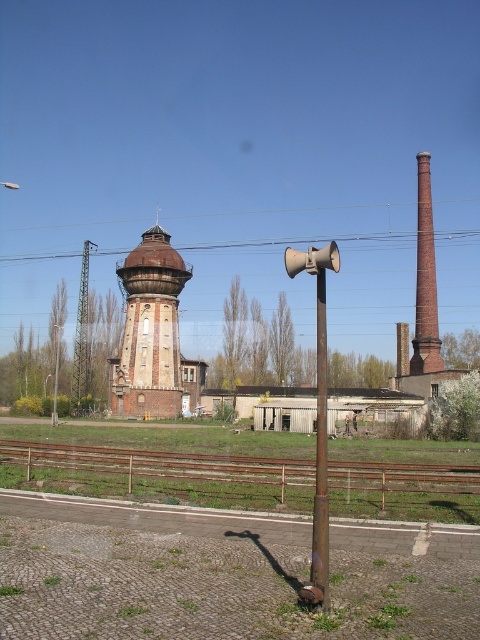
Question: Is brick textured water tower at center positioned at the back of metallic pole at center?

Choices:
 (A) no
 (B) yes

Answer: (B)

Question: Does red brick chimney at right have a smaller size compared to metallic pole at center?

Choices:
 (A) no
 (B) yes

Answer: (A)

Question: Which point is farther from the camera taking this photo?

Choices:
 (A) tap(430, 257)
 (B) tap(408, 356)

Answer: (B)

Question: Which point appears farthest from the camera in this image?

Choices:
 (A) (321, 380)
 (B) (121, 403)
 (C) (398, 369)
 (D) (439, 355)

Answer: (C)

Question: Can you confirm if red brick chimney at right is positioned above brick chimney at center right?

Choices:
 (A) yes
 (B) no

Answer: (A)

Question: Which object is farther from the camera taking this photo?

Choices:
 (A) brick chimney at center right
 (B) red brick chimney at right
 (C) brick textured water tower at center

Answer: (A)